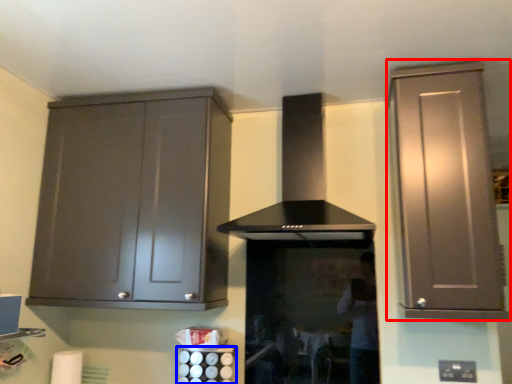
Question: Which of the following is the farthest to the observer, cabinetry (highlighted by a red box) or appliance (highlighted by a blue box)?

Choices:
 (A) cabinetry
 (B) appliance

Answer: (B)